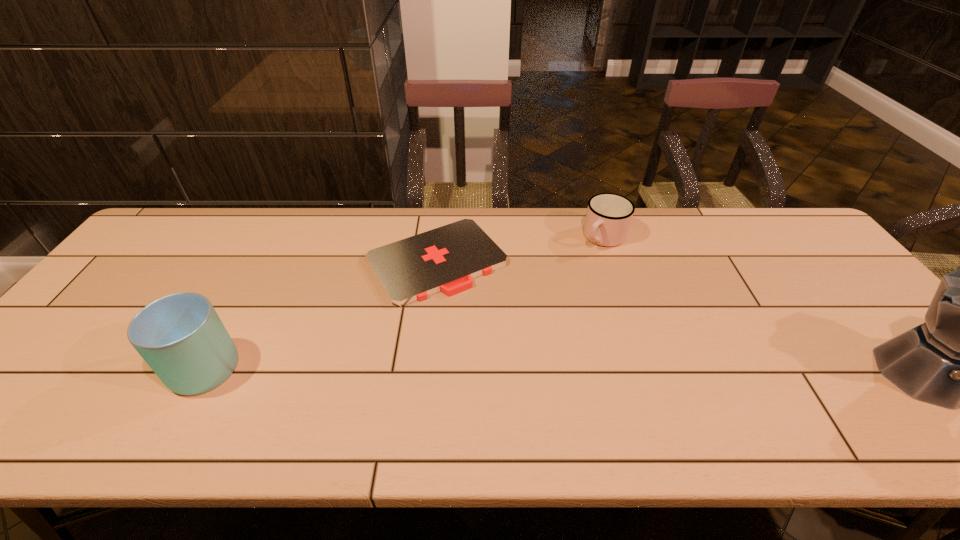
The height and width of the screenshot is (540, 960). I want to click on free space that satisfies the following two spatial constraints: 1. on the back side of the shortest object; 2. on the left side of the nearer mug, so click(259, 261).